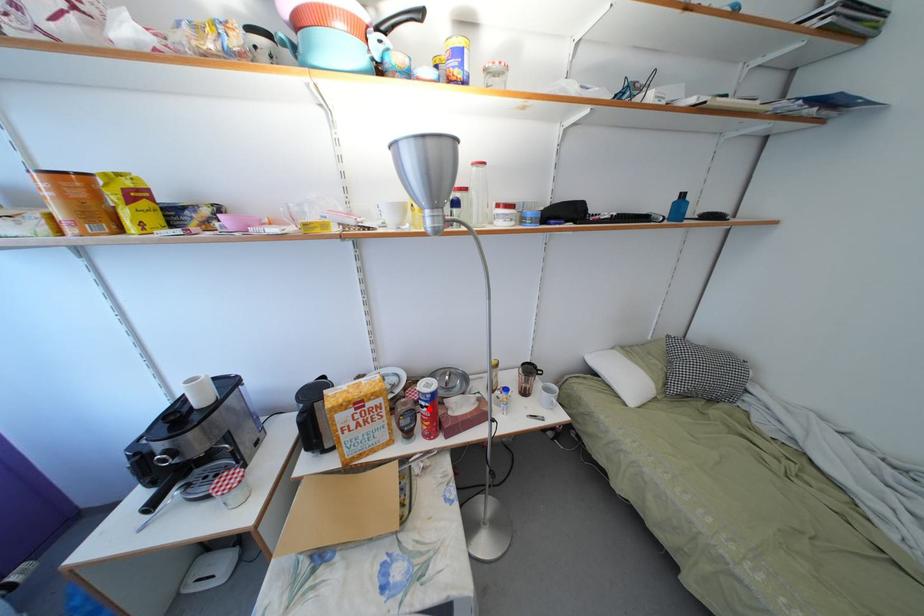
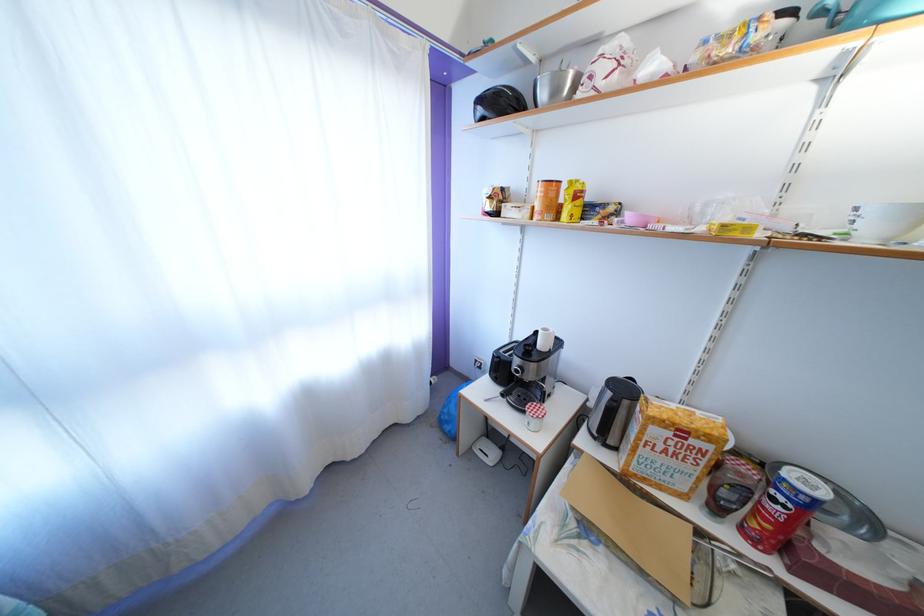
Question: I am providing you with two images of the same scene from different viewpoints. Image1 has a red point marked. In image2, the corresponding 3D location appears at what relative position? Reply with the corresponding letter.

Choices:
 (A) Closer
 (B) Farther

Answer: (A)